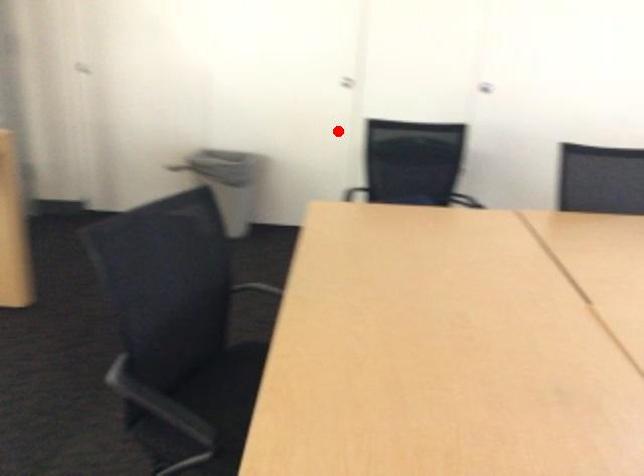
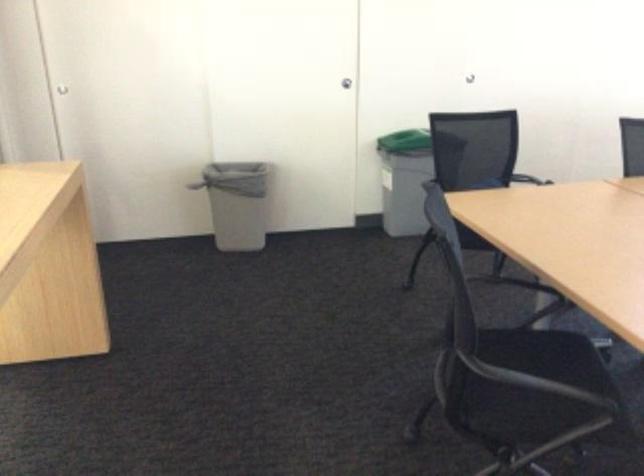
Locate, in the second image, the point that corresponds to the highlighted location in the first image.

(345, 83)